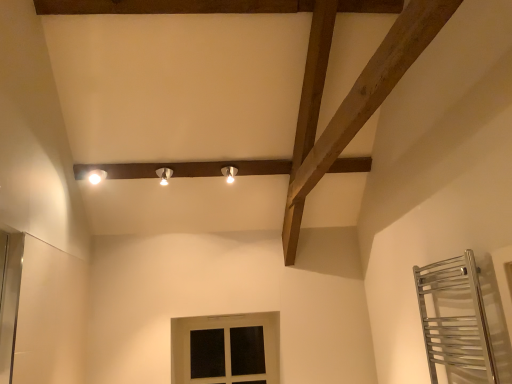
Measure the distance between point (98,171) and camera.

The depth of point (98,171) is 3.17 meters.

I want to click on white glossy light fixture at upper center, the third light fixture viewed from the left, so click(229, 173).

What is the approximate height of white glossy light fixture at upper center, the third light fixture viewed from the left?

13.38 centimeters.

Where is `matte black window at lower center`? This screenshot has height=384, width=512. matte black window at lower center is located at coordinates (225, 349).

What are the coordinates of `white glossy light fixture at upper left, the 3th light fixture positioned from the right` in the screenshot? It's located at (96, 176).

Does matte black window at lower center have a greater height compared to white glossy light fixture at upper left, the first light fixture when ordered from left to right?

Yes, matte black window at lower center is taller than white glossy light fixture at upper left, the first light fixture when ordered from left to right.

Is matte black window at lower center far away from white glossy light fixture at upper left, the first light fixture when ordered from left to right?

Yes, matte black window at lower center and white glossy light fixture at upper left, the first light fixture when ordered from left to right, are quite far apart.

Between matte black window at lower center and white glossy light fixture at upper left, the 3th light fixture positioned from the right, which one has larger width?

white glossy light fixture at upper left, the 3th light fixture positioned from the right.

Is white glossy light fixture at upper left, the first light fixture when ordered from left to right, inside or outside of white glossy light fixture at upper center, placed as the 1th light fixture when sorted from right to left?

white glossy light fixture at upper left, the first light fixture when ordered from left to right, exists outside the volume of white glossy light fixture at upper center, placed as the 1th light fixture when sorted from right to left.

In terms of width, does white glossy light fixture at upper left, the 3th light fixture positioned from the right, look wider or thinner when compared to white glossy light fixture at upper center, placed as the 1th light fixture when sorted from right to left?

In the image, white glossy light fixture at upper left, the 3th light fixture positioned from the right, appears to be wider than white glossy light fixture at upper center, placed as the 1th light fixture when sorted from right to left.

Is white glossy light fixture at upper left, the 3th light fixture positioned from the right, facing away from white glossy light fixture at upper center, the third light fixture viewed from the left?

That's not correct — white glossy light fixture at upper left, the 3th light fixture positioned from the right, is not looking away from white glossy light fixture at upper center, the third light fixture viewed from the left.

From the image's perspective, which object appears higher, white glossy light fixture at upper center, the third light fixture viewed from the left, or matte black window at lower center?

white glossy light fixture at upper center, the third light fixture viewed from the left.

Looking at this image, is white glossy light fixture at upper center, placed as the 1th light fixture when sorted from right to left, next to matte black window at lower center?

No, white glossy light fixture at upper center, placed as the 1th light fixture when sorted from right to left, is not with matte black window at lower center.

In the scene shown: Who is taller, white glossy light fixture at upper center, the third light fixture viewed from the left, or matte black window at lower center?

matte black window at lower center is taller.

Does matte silver light fixture at center, the second light fixture positioned from the left, have a greater width compared to matte black window at lower center?

Indeed, matte silver light fixture at center, the second light fixture positioned from the left, has a greater width compared to matte black window at lower center.

Which light fixture is the 1st one when counting from the left side of the matte black window at lower center? Please provide its 2D coordinates.

[(164, 175)]

Considering the relative sizes of matte silver light fixture at center, which is counted as the second light fixture, starting from the right, and matte black window at lower center in the image provided, is matte silver light fixture at center, which is counted as the second light fixture, starting from the right, shorter than matte black window at lower center?

Correct, matte silver light fixture at center, which is counted as the second light fixture, starting from the right, is not as tall as matte black window at lower center.

In the scene shown: From a real-world perspective, who is located lower, matte silver light fixture at center, the second light fixture positioned from the left, or matte black window at lower center?

matte black window at lower center, from a real-world perspective.

Is white glossy light fixture at upper left, the first light fixture when ordered from left to right, to the left or to the right of matte silver light fixture at center, the second light fixture positioned from the left, in the image?

From the image, it's evident that white glossy light fixture at upper left, the first light fixture when ordered from left to right, is to the left of matte silver light fixture at center, the second light fixture positioned from the left.

How much distance is there between white glossy light fixture at upper left, the first light fixture when ordered from left to right, and matte silver light fixture at center, the second light fixture positioned from the left?

The distance of white glossy light fixture at upper left, the first light fixture when ordered from left to right, from matte silver light fixture at center, the second light fixture positioned from the left, is 17.17 inches.

Choose the correct answer: Is white glossy light fixture at upper left, the 3th light fixture positioned from the right, inside matte silver light fixture at center, which is counted as the second light fixture, starting from the right, or outside it?

The correct answer is: outside.

Is the depth of white glossy light fixture at upper left, the first light fixture when ordered from left to right, greater than that of matte silver light fixture at center, which is counted as the second light fixture, starting from the right?

No, the depth of white glossy light fixture at upper left, the first light fixture when ordered from left to right, is less than that of matte silver light fixture at center, which is counted as the second light fixture, starting from the right.

Could you tell me if matte silver light fixture at center, the second light fixture positioned from the left, is facing white glossy light fixture at upper center, placed as the 1th light fixture when sorted from right to left?

No, matte silver light fixture at center, the second light fixture positioned from the left, is not turned towards white glossy light fixture at upper center, placed as the 1th light fixture when sorted from right to left.

Considering the sizes of objects matte silver light fixture at center, the second light fixture positioned from the left, and white glossy light fixture at upper center, placed as the 1th light fixture when sorted from right to left, in the image provided, who is shorter, matte silver light fixture at center, the second light fixture positioned from the left, or white glossy light fixture at upper center, placed as the 1th light fixture when sorted from right to left,?

With less height is white glossy light fixture at upper center, placed as the 1th light fixture when sorted from right to left.

Considering their positions, is matte silver light fixture at center, which is counted as the second light fixture, starting from the right, located in front of or behind white glossy light fixture at upper center, placed as the 1th light fixture when sorted from right to left?

Visually, matte silver light fixture at center, which is counted as the second light fixture, starting from the right, is located in front of white glossy light fixture at upper center, placed as the 1th light fixture when sorted from right to left.

Which object is further away from the camera, matte silver light fixture at center, the second light fixture positioned from the left, or white glossy light fixture at upper left, the 3th light fixture positioned from the right?

matte silver light fixture at center, the second light fixture positioned from the left.

Is point (157, 175) farther from viewer compared to point (106, 174)?

That is True.

From a real-world perspective, is matte silver light fixture at center, which is counted as the second light fixture, starting from the right, positioned above or below white glossy light fixture at upper left, the first light fixture when ordered from left to right?

From a real-world perspective, matte silver light fixture at center, which is counted as the second light fixture, starting from the right, is physically above white glossy light fixture at upper left, the first light fixture when ordered from left to right.

Is white glossy light fixture at upper left, the 3th light fixture positioned from the right, a part of matte silver light fixture at center, which is counted as the second light fixture, starting from the right?

No.

I want to click on the 1st light fixture positioned above the matte black window at lower center (from the image's perspective), so click(x=96, y=176).

In the image, there is a white glossy light fixture at upper left, the first light fixture when ordered from left to right. At what (x,y) coordinates should I click in order to perform the action: click on light fixture below it (from a real-world perspective). Please return your answer as a coordinate pair (x, y). The height and width of the screenshot is (384, 512). Looking at the image, I should click on (229, 173).

Looking at the image, which one is located further to white glossy light fixture at upper center, the third light fixture viewed from the left, matte black window at lower center or matte silver light fixture at center, the second light fixture positioned from the left?

matte black window at lower center is further to white glossy light fixture at upper center, the third light fixture viewed from the left.

Considering their positions, is white glossy light fixture at upper left, the first light fixture when ordered from left to right, positioned further to matte black window at lower center than matte silver light fixture at center, the second light fixture positioned from the left?

Based on the image, white glossy light fixture at upper left, the first light fixture when ordered from left to right, appears to be further to matte black window at lower center.

Considering their positions, is white glossy light fixture at upper left, the 3th light fixture positioned from the right, positioned further to matte black window at lower center than white glossy light fixture at upper center, placed as the 1th light fixture when sorted from right to left?

Based on the image, white glossy light fixture at upper left, the 3th light fixture positioned from the right, appears to be further to matte black window at lower center.

Estimate the real-world distances between objects in this image. Which object is closer to white glossy light fixture at upper center, placed as the 1th light fixture when sorted from right to left, matte silver light fixture at center, which is counted as the second light fixture, starting from the right, or matte black window at lower center?

matte silver light fixture at center, which is counted as the second light fixture, starting from the right, is closer to white glossy light fixture at upper center, placed as the 1th light fixture when sorted from right to left.

Based on their spatial positions, is white glossy light fixture at upper center, the third light fixture viewed from the left, or matte black window at lower center further from white glossy light fixture at upper left, the first light fixture when ordered from left to right?

matte black window at lower center is positioned further to the anchor white glossy light fixture at upper left, the first light fixture when ordered from left to right.

When comparing their distances from matte silver light fixture at center, the second light fixture positioned from the left, does white glossy light fixture at upper left, the 3th light fixture positioned from the right, or white glossy light fixture at upper center, placed as the 1th light fixture when sorted from right to left, seem further?

white glossy light fixture at upper center, placed as the 1th light fixture when sorted from right to left.

Looking at the image, which one is located closer to white glossy light fixture at upper left, the 3th light fixture positioned from the right, matte black window at lower center or white glossy light fixture at upper center, placed as the 1th light fixture when sorted from right to left?

white glossy light fixture at upper center, placed as the 1th light fixture when sorted from right to left.

When comparing their distances from matte black window at lower center, does white glossy light fixture at upper center, the third light fixture viewed from the left, or white glossy light fixture at upper left, the first light fixture when ordered from left to right, seem closer?

white glossy light fixture at upper center, the third light fixture viewed from the left, is closer to matte black window at lower center.

Where is `light fixture between matte silver light fixture at center, the second light fixture positioned from the left, and matte black window at lower center from top to bottom`? light fixture between matte silver light fixture at center, the second light fixture positioned from the left, and matte black window at lower center from top to bottom is located at coordinates (96, 176).

Where is `light fixture between white glossy light fixture at upper left, the 3th light fixture positioned from the right, and white glossy light fixture at upper center, the third light fixture viewed from the left`? light fixture between white glossy light fixture at upper left, the 3th light fixture positioned from the right, and white glossy light fixture at upper center, the third light fixture viewed from the left is located at coordinates (164, 175).